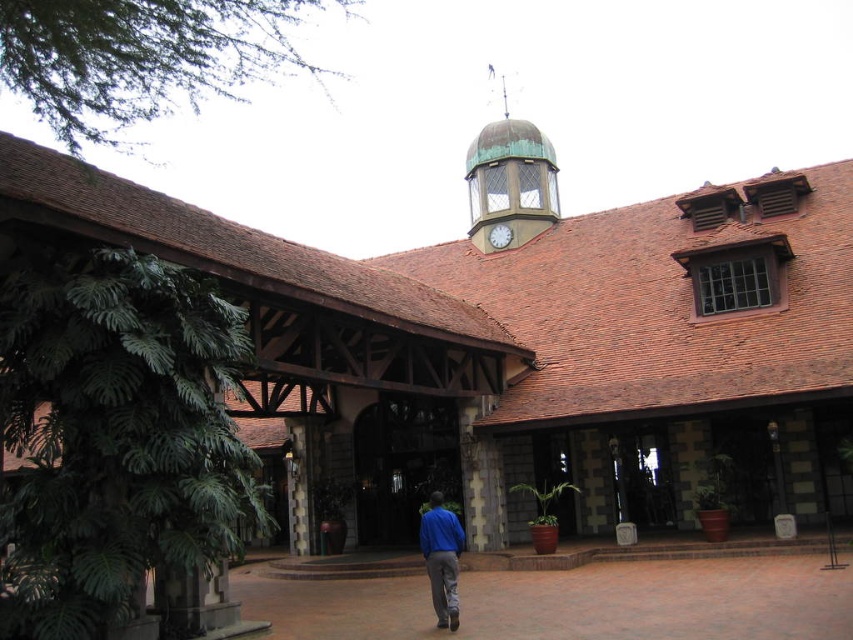
Question: In this image, where is green copper clock tower at upper center located relative to blue cotton shirt at center?

Choices:
 (A) below
 (B) above

Answer: (B)

Question: Which is farther from the white glossy clock at center?

Choices:
 (A) blue cotton shirt at center
 (B) green copper clock tower at upper center

Answer: (A)

Question: Among these points, which one is farthest from the camera?

Choices:
 (A) (500, 241)
 (B) (451, 573)

Answer: (A)

Question: Considering the relative positions of green copper clock tower at upper center and white glossy clock at center in the image provided, where is green copper clock tower at upper center located with respect to white glossy clock at center?

Choices:
 (A) left
 (B) right

Answer: (B)

Question: Does green copper clock tower at upper center have a smaller size compared to blue cotton shirt at center?

Choices:
 (A) no
 (B) yes

Answer: (A)

Question: Which point is closer to the camera?

Choices:
 (A) green copper clock tower at upper center
 (B) blue cotton shirt at center
 (C) white glossy clock at center

Answer: (B)